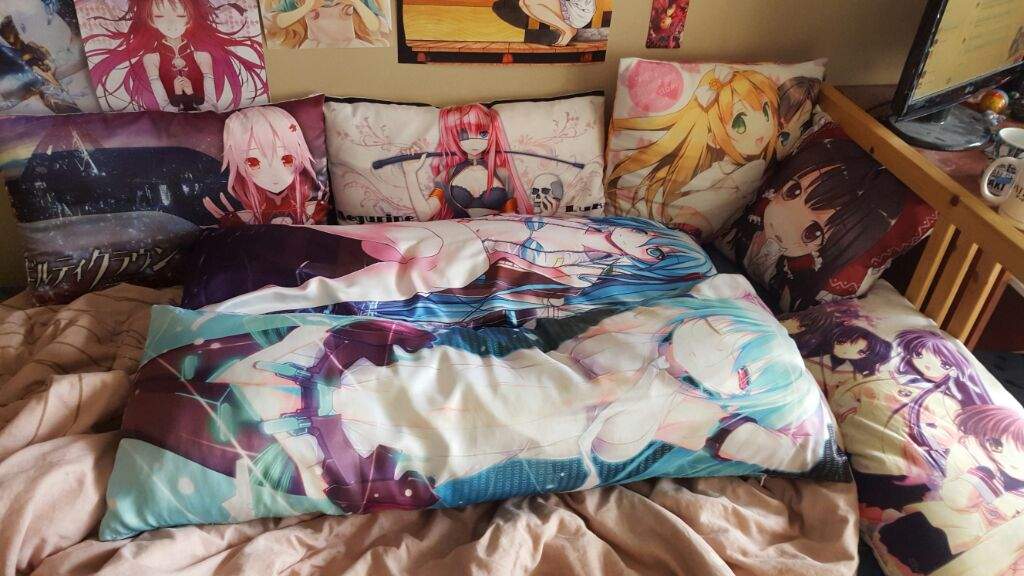
Locate an element on the screen. Image resolution: width=1024 pixels, height=576 pixels. legs of bed or desk is located at coordinates (967, 287).